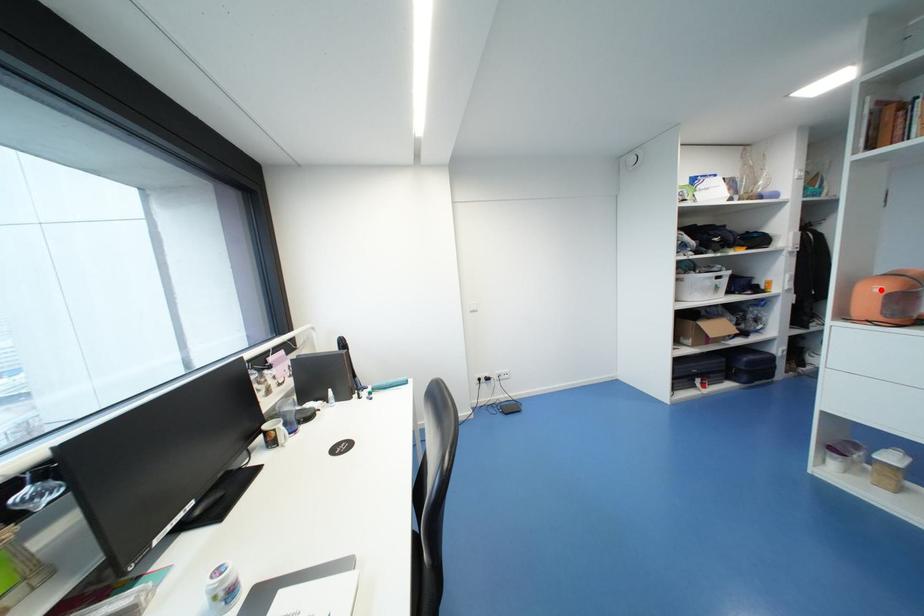
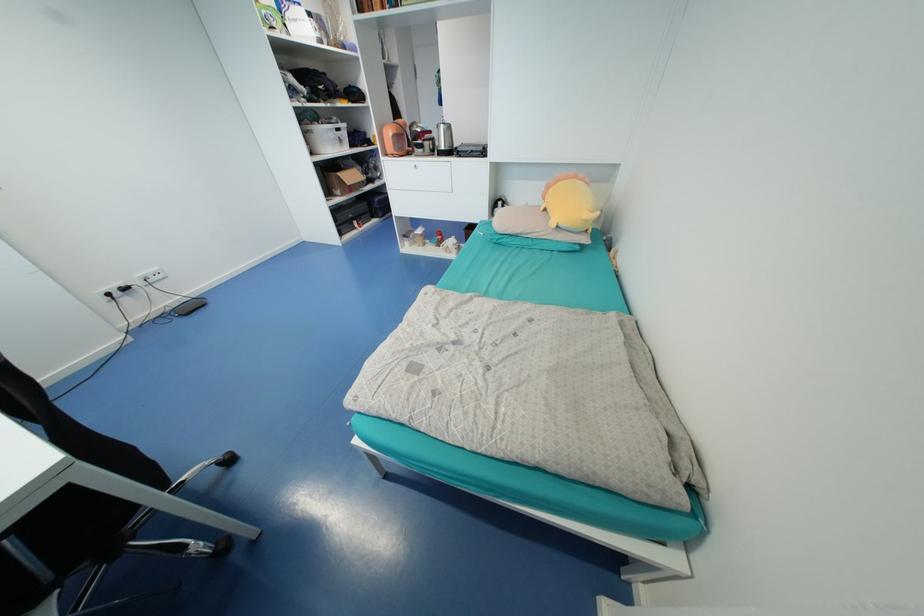
In the second image, find the point that corresponds to the highlighted location in the first image.

(394, 132)